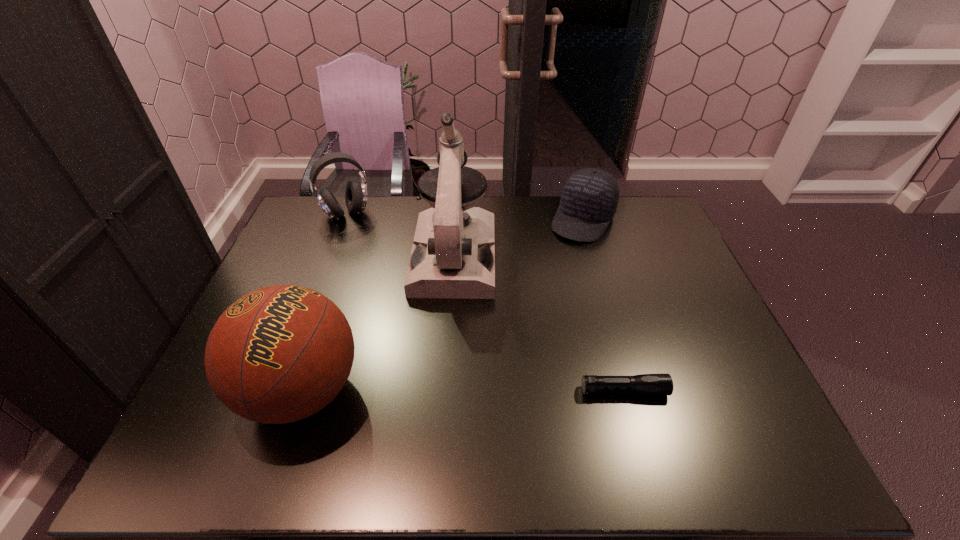
Where is `the fourth shortest object`? This screenshot has height=540, width=960. the fourth shortest object is located at coordinates (279, 354).

Identify the location of the shortest object. The width and height of the screenshot is (960, 540). (646, 384).

The height and width of the screenshot is (540, 960). In order to click on the tallest object in this screenshot , I will do 453,255.

Find the location of `the third object from right to left`. the third object from right to left is located at coordinates (453, 255).

Identify the location of the third shortest object. (356, 193).

Locate an element on the screen. This screenshot has width=960, height=540. baseball cap is located at coordinates (589, 199).

At what (x,y) coordinates should I click in order to perform the action: click on vacant space located 0.170m on the back of the second tallest object. Please return your answer as a coordinate pair (x, y). The width and height of the screenshot is (960, 540). Looking at the image, I should click on (334, 295).

Locate an element on the screen. The image size is (960, 540). vacant area situated 0.150m at the lens end of the shortest object is located at coordinates (730, 390).

Where is `free point located 0.340m at the eyepiece of the tallest object`? Image resolution: width=960 pixels, height=540 pixels. free point located 0.340m at the eyepiece of the tallest object is located at coordinates (441, 406).

The width and height of the screenshot is (960, 540). What are the coordinates of `vacant space located at the eyepiece of the tallest object` in the screenshot? It's located at (447, 328).